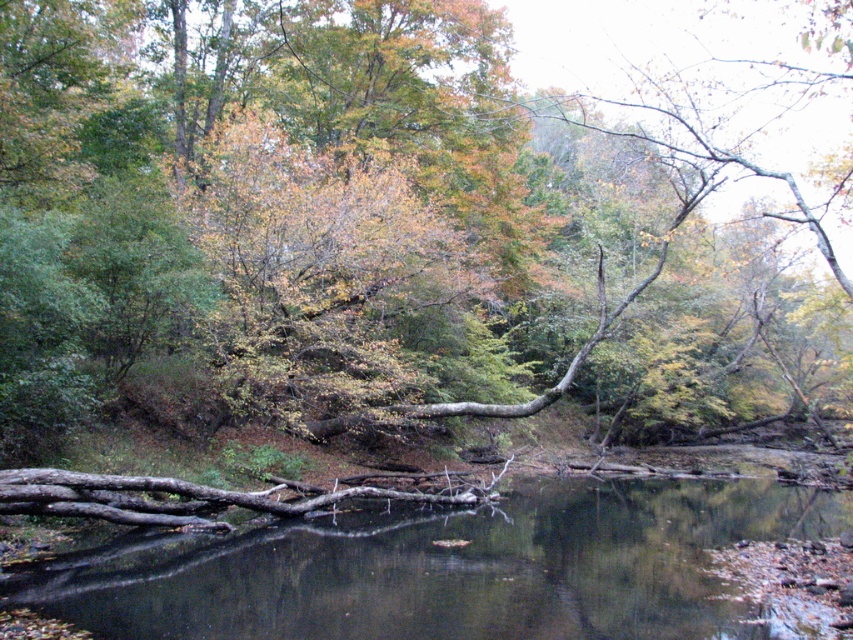
Is brown rough tree trunk at center smaller than brown wood at center?

No, brown rough tree trunk at center is not smaller than brown wood at center.

Image resolution: width=853 pixels, height=640 pixels. Describe the element at coordinates (321, 225) in the screenshot. I see `brown rough tree trunk at center` at that location.

Where is `brown rough tree trunk at center`? The width and height of the screenshot is (853, 640). brown rough tree trunk at center is located at coordinates [x=321, y=225].